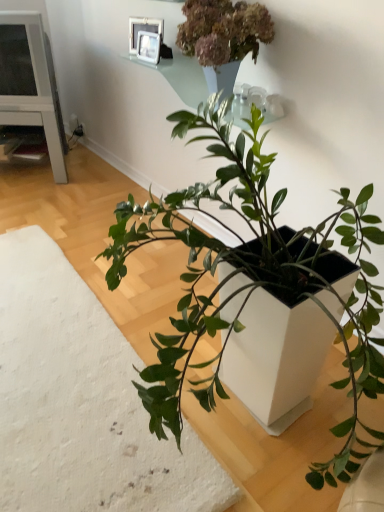
Question: Is white matte planter at lower left taller or shorter than white matte planter at center, which ranks as the 2th houseplant in right-to-left order?

Choices:
 (A) short
 (B) tall

Answer: (A)

Question: From the image's perspective, is white matte planter at lower left located above or below white matte planter at center, which ranks as the 2th houseplant in right-to-left order?

Choices:
 (A) above
 (B) below

Answer: (B)

Question: Which of these objects is positioned closest to the white matte planter at center, marked as the 1th houseplant in a left-to-right arrangement?

Choices:
 (A) white glossy table at left
 (B) metallic silver picture frame at upper center, which ranks as the first picture frame in bottom-to-top order
 (C) green matte plant at upper center, which ranks as the first houseplant in right-to-left order
 (D) glassy white vase at upper center
 (E) white glossy picture frame at upper center, which is the first picture frame in top-to-bottom order

Answer: (C)

Question: Which object is positioned closest to the metallic silver picture frame at upper center, which ranks as the first picture frame in bottom-to-top order?

Choices:
 (A) white matte planter at lower left
 (B) green matte plant at upper center, which ranks as the first houseplant in right-to-left order
 (C) white glossy table at left
 (D) glassy white vase at upper center
 (E) white matte planter at center, marked as the 1th houseplant in a left-to-right arrangement

Answer: (D)